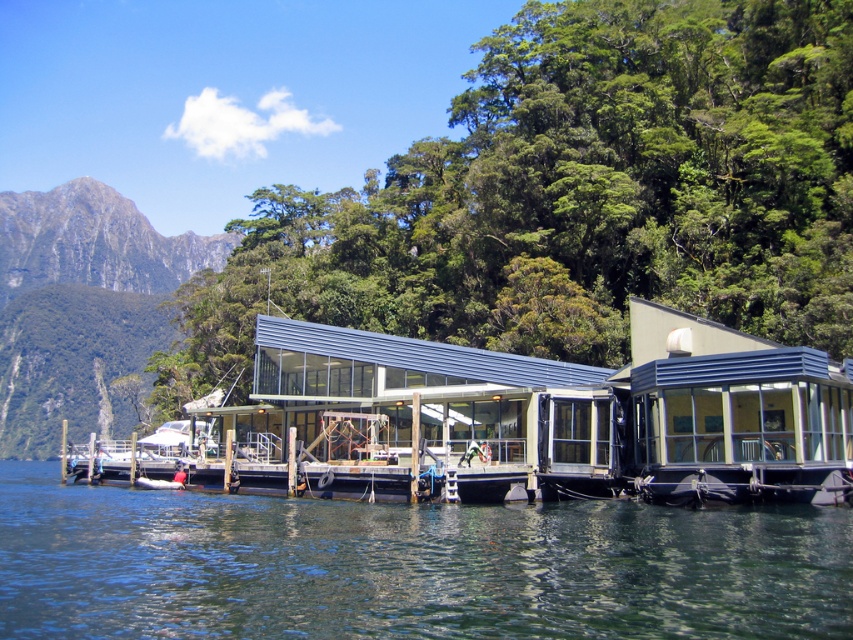
Does transparent water at lower center appear over matte glass building at center?

No, transparent water at lower center is not above matte glass building at center.

Can you confirm if transparent water at lower center is positioned to the left of matte glass building at center?

Indeed, transparent water at lower center is positioned on the left side of matte glass building at center.

The image size is (853, 640). In order to click on transparent water at lower center in this screenshot , I will do `click(408, 566)`.

Is matte glass building at center taller than green rock at left?

Incorrect, matte glass building at center's height is not larger of green rock at left's.

Which is in front, point (320, 378) or point (39, 380)?

Point (320, 378) is more forward.

Is point (257, 337) farther from camera compared to point (49, 204)?

That is False.

In order to click on matte glass building at center in this screenshot , I will do `click(550, 416)`.

Can you confirm if transparent water at lower center is shorter than green rock at left?

Yes.

Can you confirm if transparent water at lower center is positioned below green rock at left?

Yes, transparent water at lower center is below green rock at left.

Which is behind, point (688, 609) or point (15, 225)?

The point (15, 225) is more distant.

At what (x,y) coordinates should I click in order to perform the action: click on transparent water at lower center. Please return your answer as a coordinate pair (x, y). Looking at the image, I should click on (408, 566).